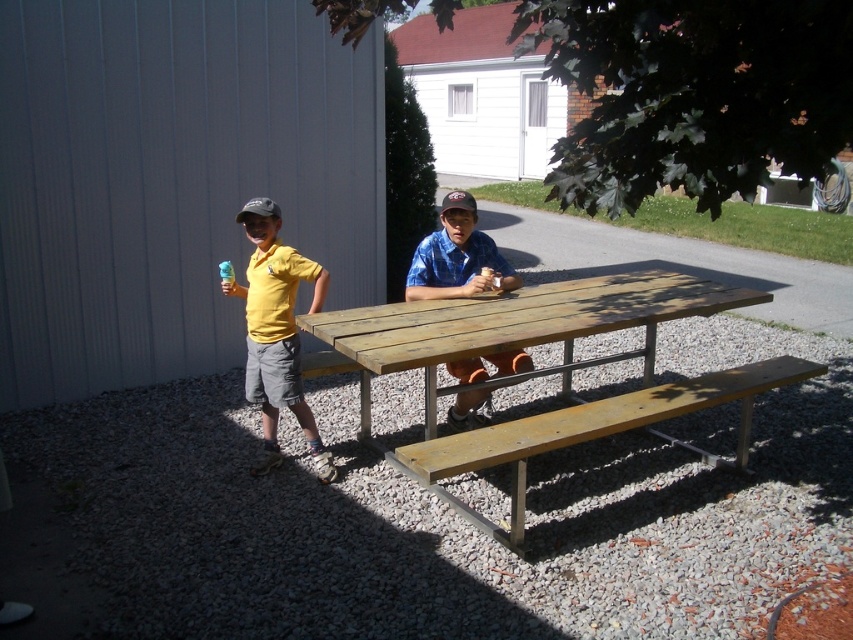
Question: Is gray gravel at lower center to the right of blue plaid shirt at center from the viewer's perspective?

Choices:
 (A) no
 (B) yes

Answer: (A)

Question: Does yellow matte shirt at left appear on the left side of blue plaid shirt at center?

Choices:
 (A) no
 (B) yes

Answer: (B)

Question: Which is nearer to the gray gravel at lower center?

Choices:
 (A) yellow matte shirt at left
 (B) light brown wooden bench at center

Answer: (B)

Question: Based on their relative distances, which object is farther from the weathered wood picnic table at center?

Choices:
 (A) light brown wooden bench at center
 (B) gray gravel at lower center
 (C) yellow matte shirt at left
 (D) blue plaid shirt at center

Answer: (B)

Question: Is light brown wooden bench at center positioned in front of yellow matte shirt at left?

Choices:
 (A) yes
 (B) no

Answer: (A)

Question: Which of the following is the farthest from the observer?

Choices:
 (A) (635, 413)
 (B) (503, 356)
 (C) (310, 276)

Answer: (B)